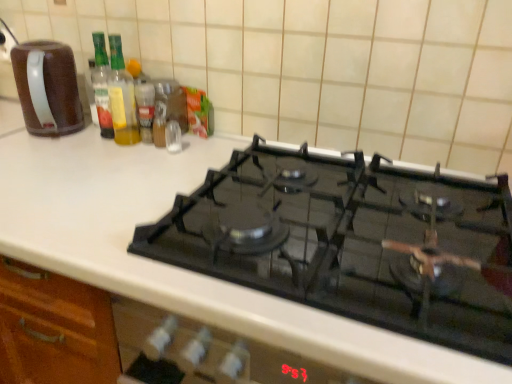
Question: From the image's perspective, is metallic spice container at upper center above or below translucent glass bottle at upper left, arranged as the second bottle when viewed from the right?

Choices:
 (A) below
 (B) above

Answer: (A)

Question: In terms of width, does metallic spice container at upper center look wider or thinner when compared to translucent glass bottle at upper left, arranged as the second bottle when viewed from the right?

Choices:
 (A) thin
 (B) wide

Answer: (B)

Question: Which is nearer to the brown matte coffee pot at left?

Choices:
 (A) translucent glass spice at center, which is the 2th bottle from left to right
 (B) metallic spice container at upper center
 (C) translucent glass bottle at upper left, arranged as the second bottle when viewed from the right

Answer: (C)

Question: Which object is positioned closest to the translucent glass spice at center, which is the 2th bottle from left to right?

Choices:
 (A) translucent glass bottle at upper left, arranged as the second bottle when viewed from the right
 (B) metallic spice container at upper center
 (C) brown matte coffee pot at left

Answer: (A)